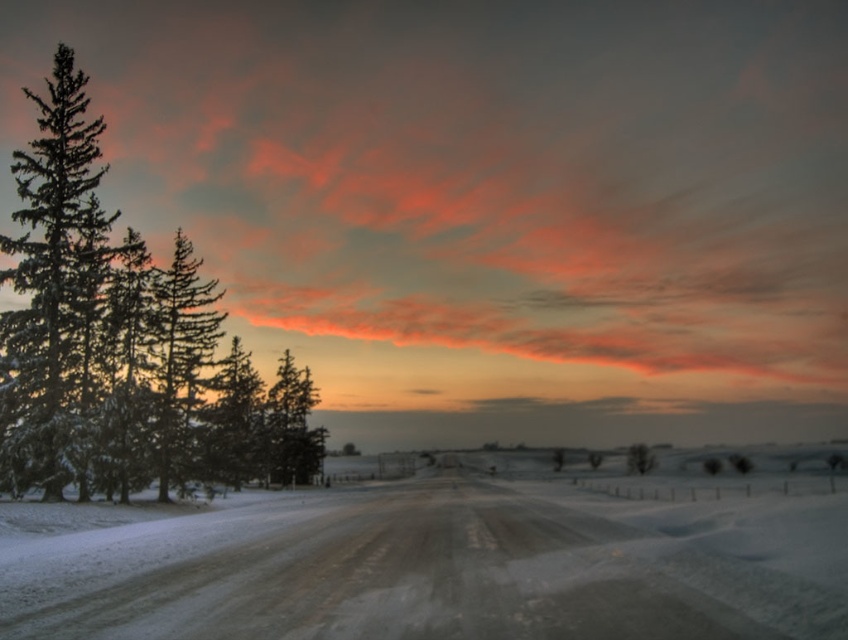
Question: Which point appears farthest from the camera in this image?

Choices:
 (A) (447, 492)
 (B) (52, 72)
 (C) (297, 449)
 (D) (90, 292)

Answer: (B)

Question: Is snow-covered pine trees at left further to the viewer compared to green matte tree at center?

Choices:
 (A) no
 (B) yes

Answer: (A)

Question: Estimate the real-world distances between objects in this image. Which object is farther from the green snow-covered trees at left?

Choices:
 (A) white powdery snow at center
 (B) snow-covered pine trees at left
 (C) green matte tree at center

Answer: (C)

Question: Which object is closer to the camera taking this photo?

Choices:
 (A) snow-covered pine trees at left
 (B) white powdery snow at center

Answer: (B)

Question: Can you confirm if white powdery snow at center is positioned to the right of green snow-covered trees at left?

Choices:
 (A) no
 (B) yes

Answer: (B)

Question: Can you confirm if white powdery snow at center is positioned to the left of green snow-covered trees at left?

Choices:
 (A) no
 (B) yes

Answer: (A)